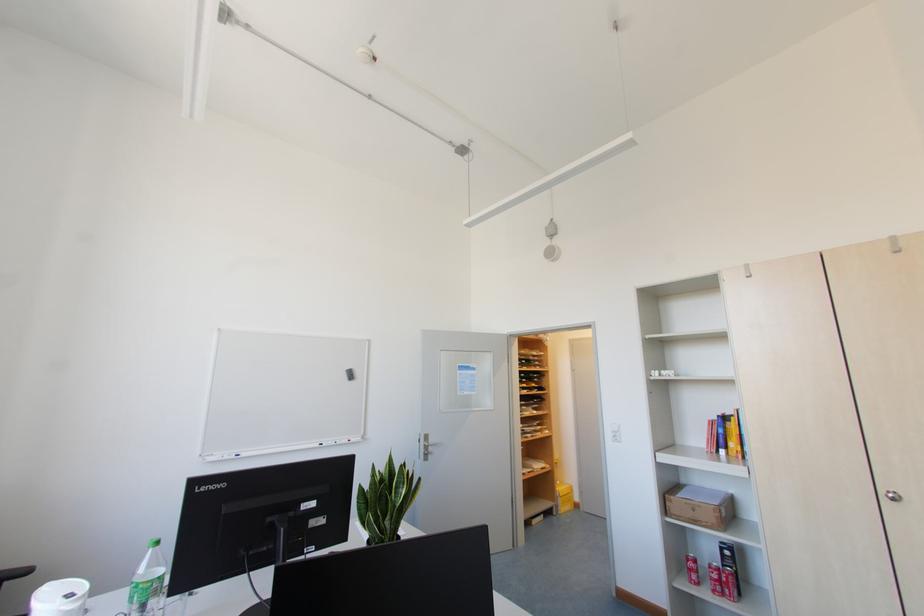
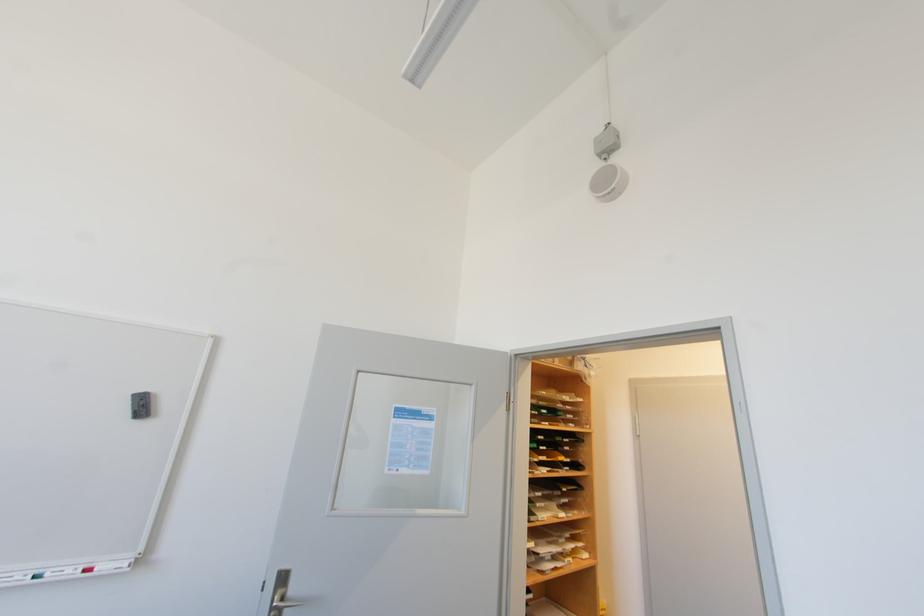
Question: In a continuous first-person perspective shot, in which direction is the camera moving?

Choices:
 (A) Left
 (B) Right
 (C) Forward
 (D) Backward

Answer: (C)